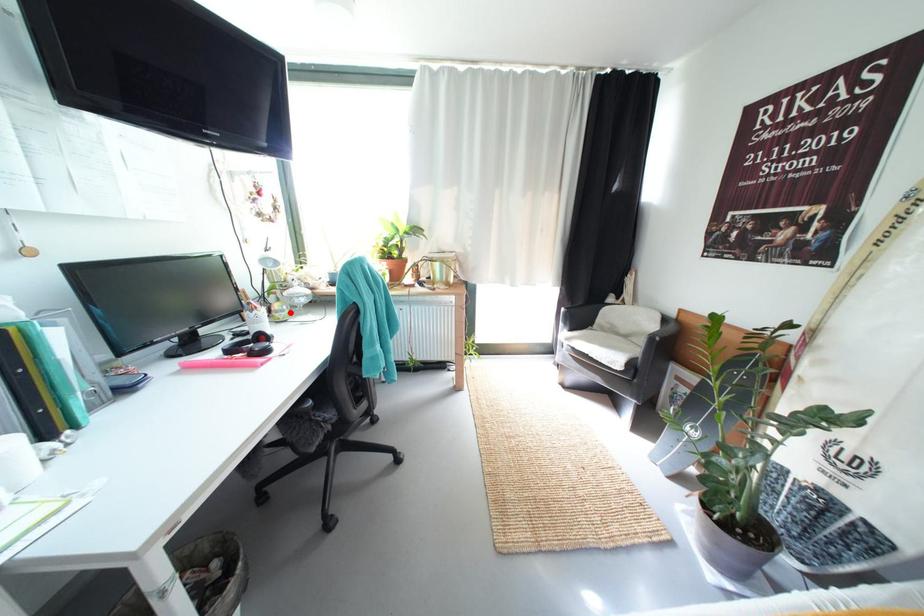
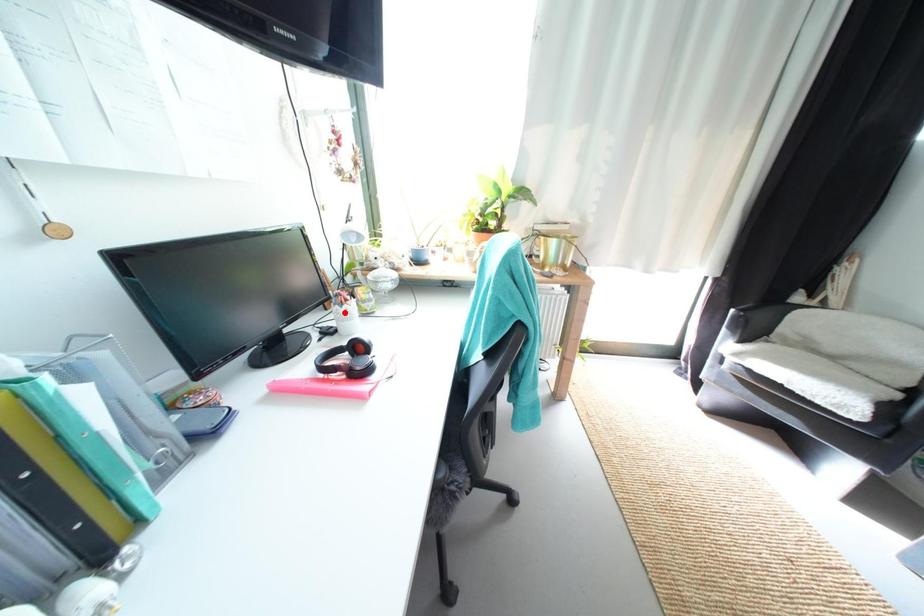
I am providing you with two images of the same scene from different viewpoints. A red point is marked on the first image and another point is marked on the second image. Is the red point in image1 aligned with the point shown in image2?

No